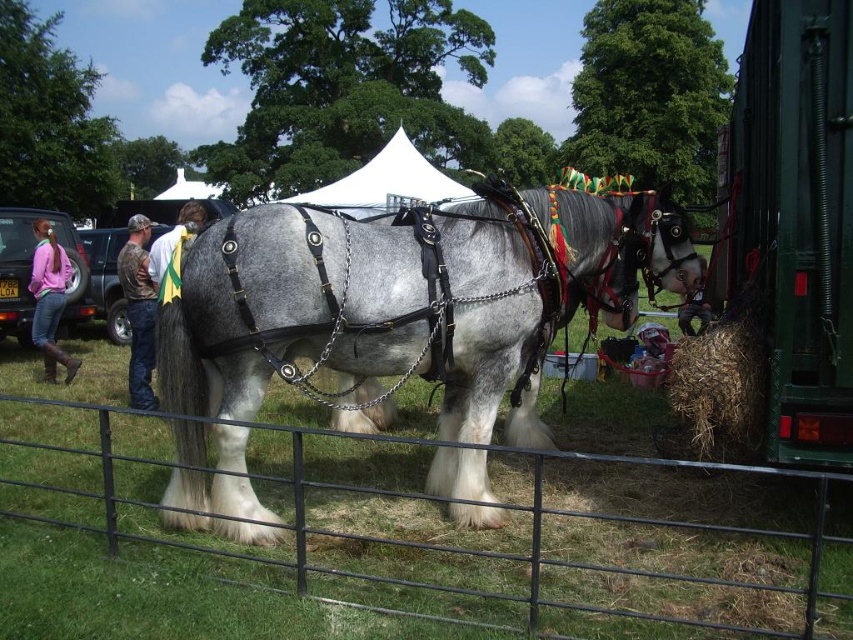
Between point (190, 244) and point (677, 396), which one is positioned in front?

Point (677, 396) is in front.

Which is more to the right, gray shaggy horse at center or brown straw at lower right?

brown straw at lower right is more to the right.

This screenshot has height=640, width=853. Find the location of `gray shaggy horse at center`. gray shaggy horse at center is located at coordinates click(408, 296).

The width and height of the screenshot is (853, 640). What do you see at coordinates (402, 544) in the screenshot?
I see `metallic wire fence at center` at bounding box center [402, 544].

Based on the photo, can you confirm if metallic wire fence at center is thinner than brown straw at lower right?

In fact, metallic wire fence at center might be wider than brown straw at lower right.

What do you see at coordinates (402, 544) in the screenshot? I see `metallic wire fence at center` at bounding box center [402, 544].

Find the location of a particular element. This screenshot has height=640, width=853. metallic wire fence at center is located at coordinates (402, 544).

Is point (167, 627) more distant than point (418, 320)?

No.

Where is `metallic wire fence at center`? The height and width of the screenshot is (640, 853). metallic wire fence at center is located at coordinates coord(402,544).